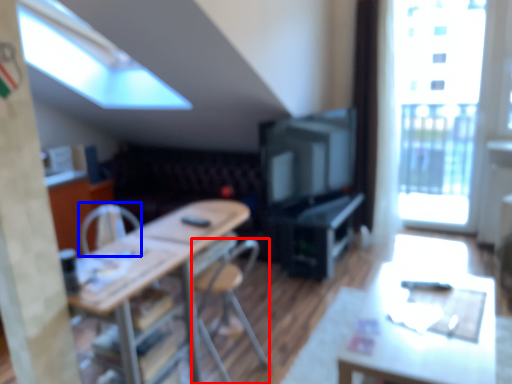
Question: Which object is closer to the camera taking this photo, chair (highlighted by a red box) or armchair (highlighted by a blue box)?

Choices:
 (A) chair
 (B) armchair

Answer: (A)